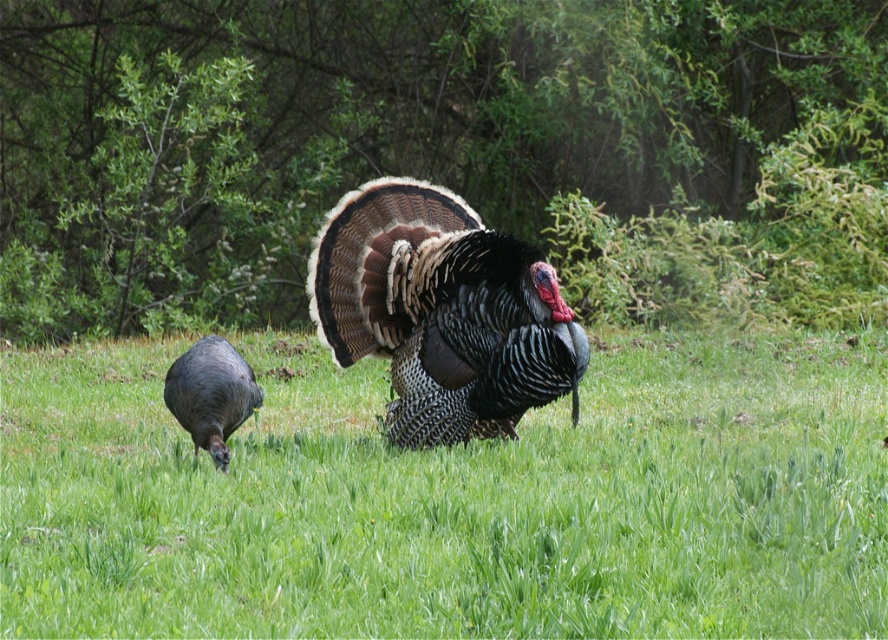
You are a photographer standing in the field. You want to take a photo that includes both the shiny iridescent turkey at center and the shiny dark gray turkey at lower left. Given that your camera has a maximum focus range of 30 inches, will you be able to capture both turkeys in focus without moving closer?

The distance between the shiny iridescent turkey at center and the shiny dark gray turkey at lower left is 35.68 inches, which exceeds the camera maximum focus range of 30 inches. Therefore, you cannot capture both turkeys in focus without moving closer.

Based on the photo, you are a wildlife photographer trying to capture a photo of both the shiny iridescent turkey at center and the shiny dark gray turkey at lower left. You have a camera with a 1.5 meter wide lens. Will the lens be wide enough to capture both turkeys in the same frame?

The shiny iridescent turkey at center might be wider than the shiny dark gray turkey at lower left, but since the lens is 1.5 meters wide, it should be sufficient to capture both turkeys as long as their combined width does not exceed the lens width. However, without exact measurements, it is uncertain. Consider adjusting the camera angle or position for the best shot.

You are standing at the edge of the field and want to walk towards the shiny dark gray turkey at lower left without stepping on the green grass at center. Is this possible?

The green grass at center is 3.26 meters away from the shiny dark gray turkey at lower left. Since you are at the edge of the field, you can walk around the green grass at center to reach the shiny dark gray turkey at lower left without stepping on it.